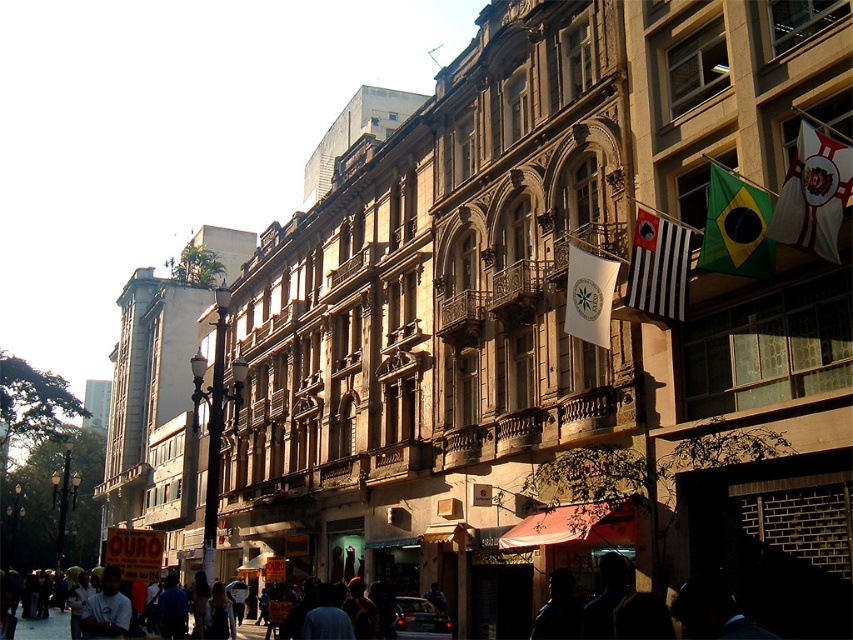
Question: Does light blue shirt at lower left come in front of dark gray fabric crowd at center?

Choices:
 (A) yes
 (B) no

Answer: (A)

Question: Considering the real-world distances, which object is closest to the light blue shirt at lower left?

Choices:
 (A) silhouette of person at center
 (B) dark gray fabric crowd at center

Answer: (A)

Question: Based on their relative distances, which object is nearer to the silhouette of person at center?

Choices:
 (A) light blue shirt at lower left
 (B) silhouette figure at center
 (C) dark gray fabric crowd at center

Answer: (B)

Question: Can you confirm if silhouette figure at center is thinner than silhouette of person at center?

Choices:
 (A) no
 (B) yes

Answer: (A)

Question: Can you confirm if silhouette of person at center is smaller than dark gray fabric crowd at center?

Choices:
 (A) yes
 (B) no

Answer: (A)

Question: Which of the following is the farthest from the observer?

Choices:
 (A) silhouette figure at center
 (B) silhouette of person at center
 (C) light blue shirt at lower left

Answer: (C)